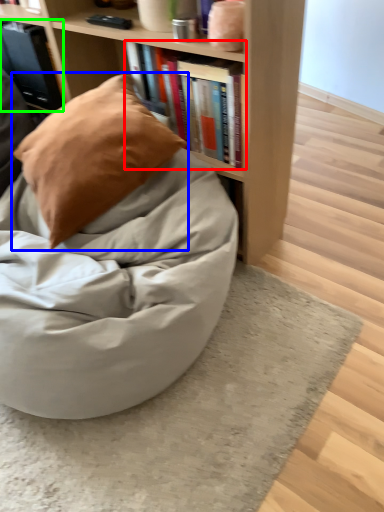
Question: Considering the real-world distances, which object is closest to book (highlighted by a red box)? pillow (highlighted by a blue box) or book (highlighted by a green box).

Choices:
 (A) pillow
 (B) book

Answer: (A)